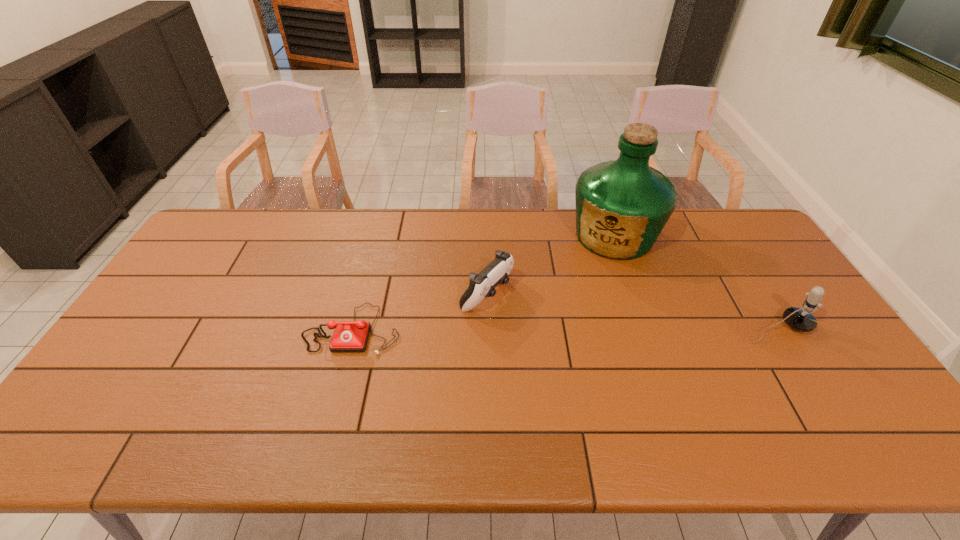
The height and width of the screenshot is (540, 960). Identify the location of vacant space at the near left corner. (128, 401).

Where is `vacant region at the far right corner of the desktop`? This screenshot has width=960, height=540. vacant region at the far right corner of the desktop is located at coordinates (755, 250).

This screenshot has height=540, width=960. Identify the location of free space that is in between the rightmost object and the telephone. (565, 329).

At what (x,y) coordinates should I click in order to perform the action: click on empty space between the rightmost object and the leftmost object. Please return your answer as a coordinate pair (x, y). Looking at the image, I should click on (565, 329).

This screenshot has width=960, height=540. Find the location of `vacant area that lies between the second shortest object and the leftmost object`. vacant area that lies between the second shortest object and the leftmost object is located at coordinates (420, 312).

Locate an element on the screen. The width and height of the screenshot is (960, 540). empty space between the liquor and the third object from right to left is located at coordinates (550, 266).

You are a GUI agent. You are given a task and a screenshot of the screen. Output one action in this format:
    pyautogui.click(x=<x>, y=<y>)
    Task: Click on the vacant area between the microphone and the leftmost object
    This screenshot has width=960, height=540.
    Given the screenshot: What is the action you would take?
    pyautogui.click(x=565, y=329)

Where is `free point between the second object from right to left and the control`? The height and width of the screenshot is (540, 960). free point between the second object from right to left and the control is located at coordinates (550, 266).

You are a GUI agent. You are given a task and a screenshot of the screen. Output one action in this format:
    pyautogui.click(x=<x>, y=<y>)
    Task: Click on the vacant area that lies between the shortest object and the microphone
    The image size is (960, 540).
    Given the screenshot: What is the action you would take?
    pyautogui.click(x=565, y=329)

Locate an element on the screen. The height and width of the screenshot is (540, 960). vacant space in between the rightmost object and the tallest object is located at coordinates (696, 282).